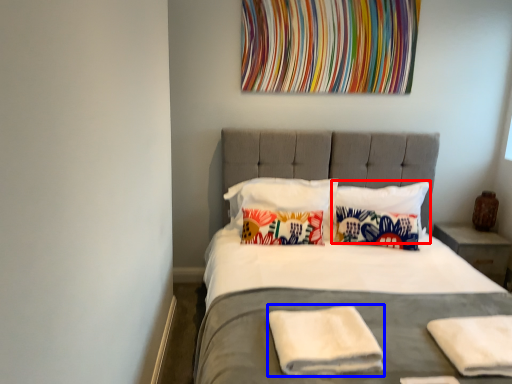
Question: Which of the following is the closest to the observer, pillow (highlighted by a red box) or material (highlighted by a blue box)?

Choices:
 (A) pillow
 (B) material

Answer: (B)